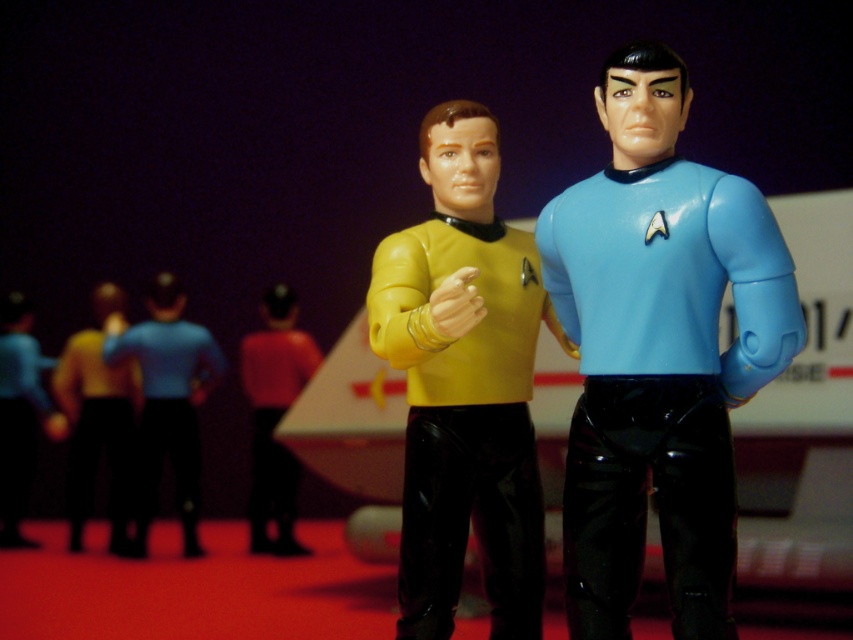
Question: Which point is farther to the camera?

Choices:
 (A) matte yellow plastic uniform at center
 (B) matte blue uniform at center

Answer: (B)

Question: Which point is closer to the camera?

Choices:
 (A) (157, 332)
 (B) (93, 342)
 (C) (270, 353)
 (D) (480, 529)

Answer: (D)

Question: Is blue glossy uniform at center to the right of matte yellow plastic uniform at center from the viewer's perspective?

Choices:
 (A) no
 (B) yes

Answer: (B)

Question: Is blue glossy uniform at center further to the viewer compared to matte red uniform at center?

Choices:
 (A) yes
 (B) no

Answer: (B)

Question: Is matte blue uniform at center wider than matte red uniform at center?

Choices:
 (A) yes
 (B) no

Answer: (A)

Question: Based on their relative distances, which object is nearer to the blue glossy uniform at center?

Choices:
 (A) matte blue uniform at center
 (B) matte black uniform at center

Answer: (A)